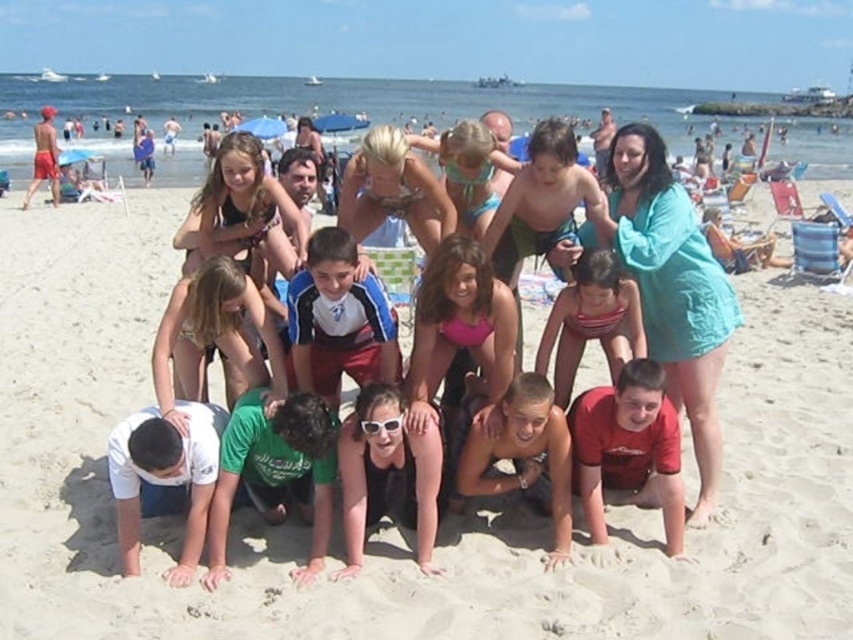
Question: Which point appears farthest from the camera in this image?

Choices:
 (A) coord(68,289)
 (B) coord(637,378)
 (C) coord(686,337)
 (D) coord(628,320)

Answer: (A)

Question: Among these points, which one is farthest from the camera?

Choices:
 (A) (640, 358)
 (B) (608, 332)

Answer: (B)

Question: Is beige sandy beach at center bigger than striped swimsuit at center?

Choices:
 (A) yes
 (B) no

Answer: (A)

Question: Is beige sandy beach at center in front of red matte shirt at lower center?

Choices:
 (A) yes
 (B) no

Answer: (A)

Question: Observing the image, what is the correct spatial positioning of teal fabric shirt at upper right in reference to red matte shirt at lower center?

Choices:
 (A) above
 (B) below

Answer: (A)

Question: Which of the following is the farthest from the observer?

Choices:
 (A) striped swimsuit at center
 (B) red matte shirt at lower center
 (C) teal fabric shirt at upper right
 (D) beige sandy beach at center

Answer: (C)